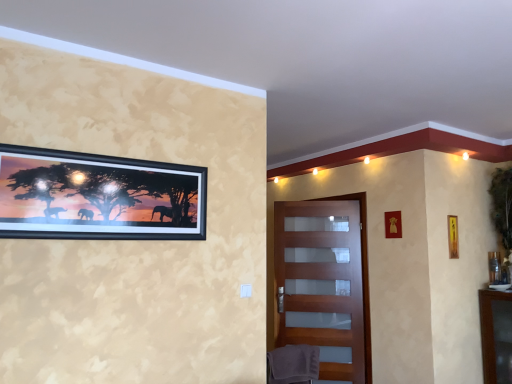
Question: Considering the positions of matte wooden door at center and wooden picture frame at upper right, positioned as the second picture frame in front-to-back order, in the image, is matte wooden door at center wider or thinner than wooden picture frame at upper right, positioned as the second picture frame in front-to-back order,?

Choices:
 (A) thin
 (B) wide

Answer: (B)

Question: Considering the positions of matte wooden door at center and wooden picture frame at upper right, placed as the 3th picture frame when sorted from back to front, in the image, is matte wooden door at center taller or shorter than wooden picture frame at upper right, placed as the 3th picture frame when sorted from back to front,?

Choices:
 (A) short
 (B) tall

Answer: (B)

Question: Which object is the closest to the gray fabric swivel chair at lower center?

Choices:
 (A) matte wooden door at center
 (B) metallic gold picture frame at upper right, acting as the second picture frame starting from the left
 (C) black matte picture frame at upper left, which appears as the fourth picture frame when viewed from the right
 (D) metallic gold picture frame at right, positioned as the fourth picture frame in left-to-right order
 (E) wooden picture frame at upper right, placed as the 3th picture frame when sorted from back to front

Answer: (C)

Question: Estimate the real-world distances between objects in this image. Which object is closer to the matte wooden door at center?

Choices:
 (A) metallic gold picture frame at right, positioned as the fourth picture frame in left-to-right order
 (B) wooden picture frame at upper right, positioned as the second picture frame in front-to-back order
 (C) gray fabric swivel chair at lower center
 (D) black matte picture frame at upper left, arranged as the first picture frame when viewed from the left
 (E) metallic gold picture frame at upper right, marked as the third picture frame in a front-to-back arrangement

Answer: (E)